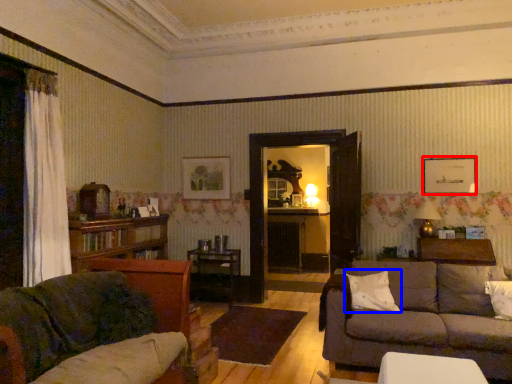
Question: Among these objects, which one is nearest to the camera, picture frame (highlighted by a red box) or pillow (highlighted by a blue box)?

Choices:
 (A) picture frame
 (B) pillow

Answer: (B)